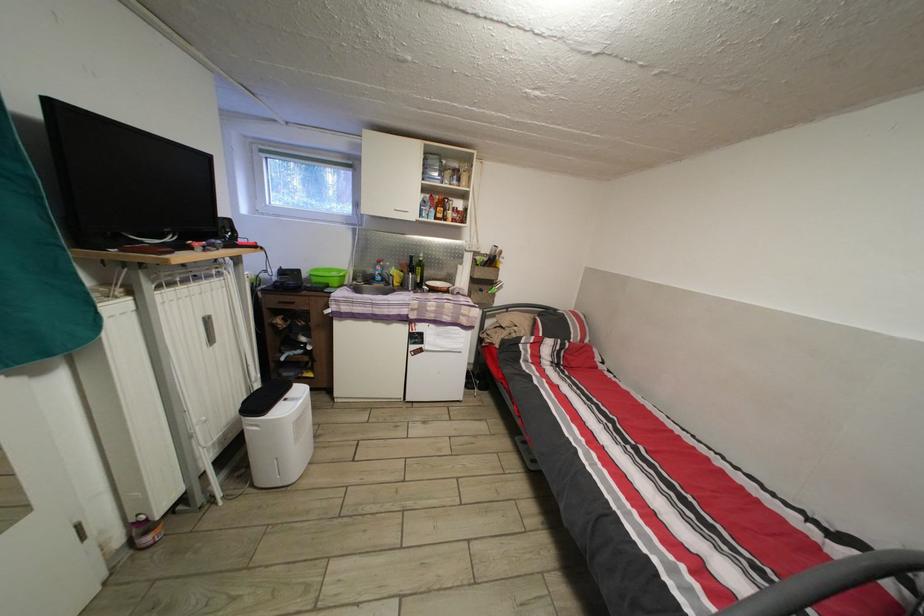
Locate an element on the screen. The width and height of the screenshot is (924, 616). yellow bottle is located at coordinates (395, 276).